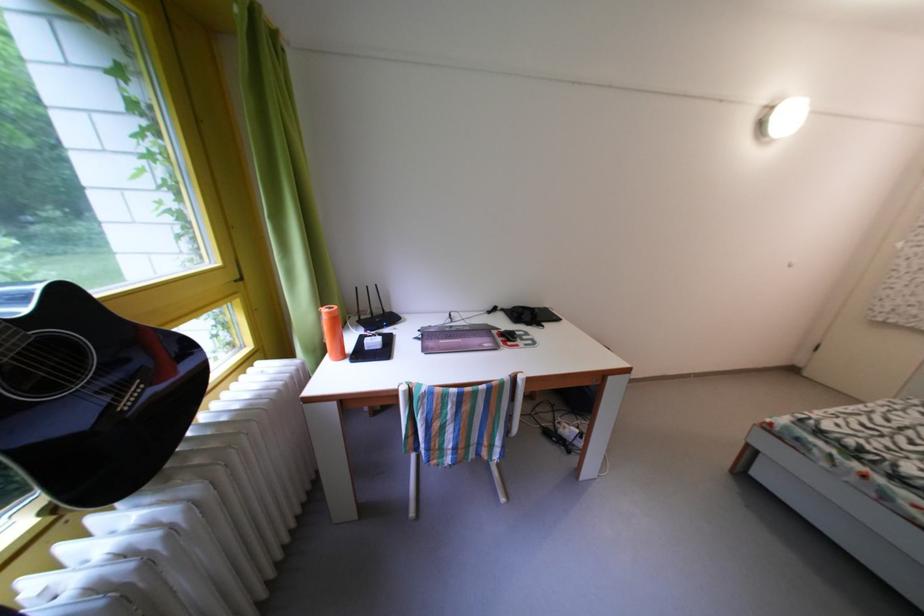
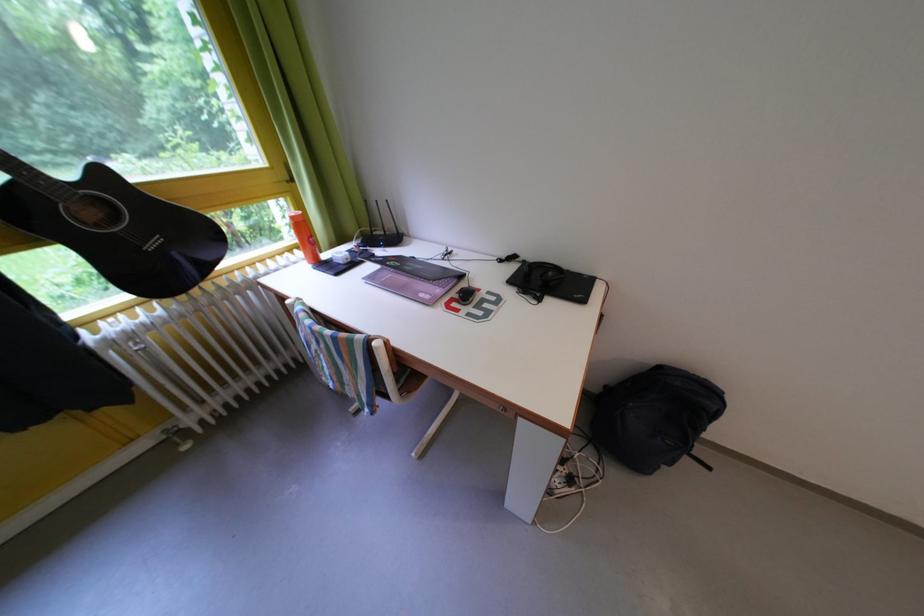
Where in the second image is the point corresponding to (x=269, y=369) from the first image?

(305, 257)